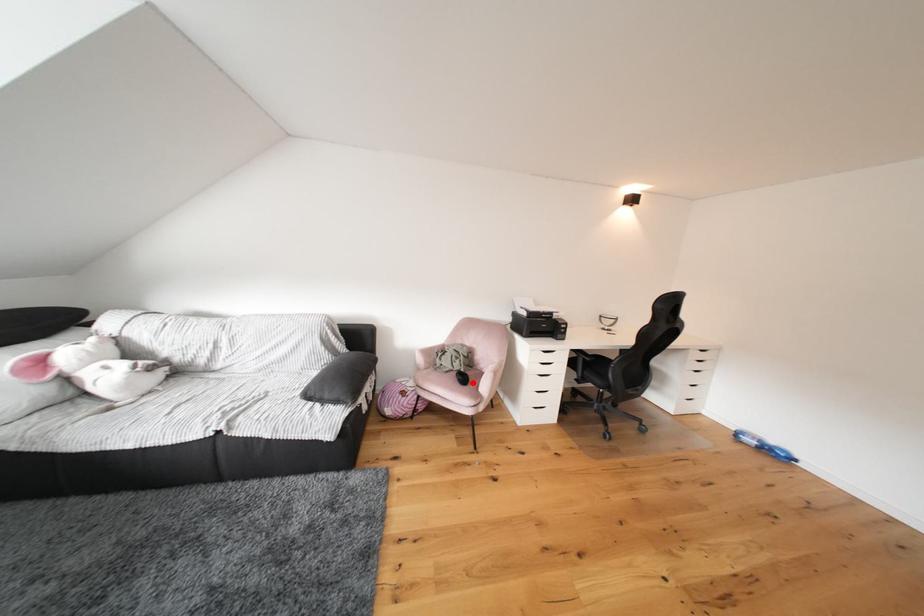
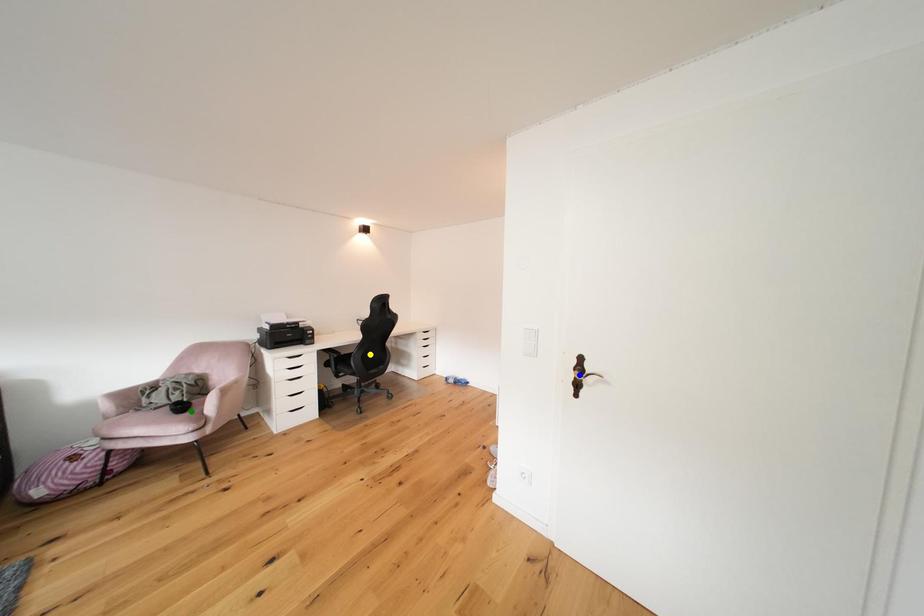
Question: I am providing you with two images of the same scene from different viewpoints. A red point is marked on the first image. You are given multiple points on the second image. Which point in image 2 represents the same 3d spot as the red point in image 1?

Choices:
 (A) green point
 (B) blue point
 (C) yellow point

Answer: (A)